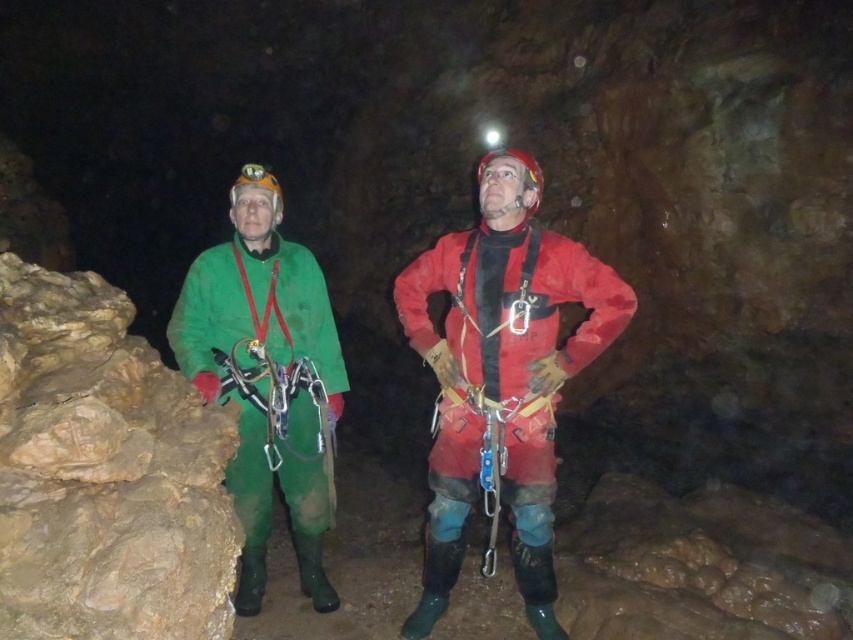
Who is taller, matte red jacket at center or green matte jacket at left?

matte red jacket at center is taller.

Between point (405, 323) and point (311, 598), which one is positioned behind?

The point (311, 598) is more distant.

Find the location of a particular element. The image size is (853, 640). matte red jacket at center is located at coordinates (502, 372).